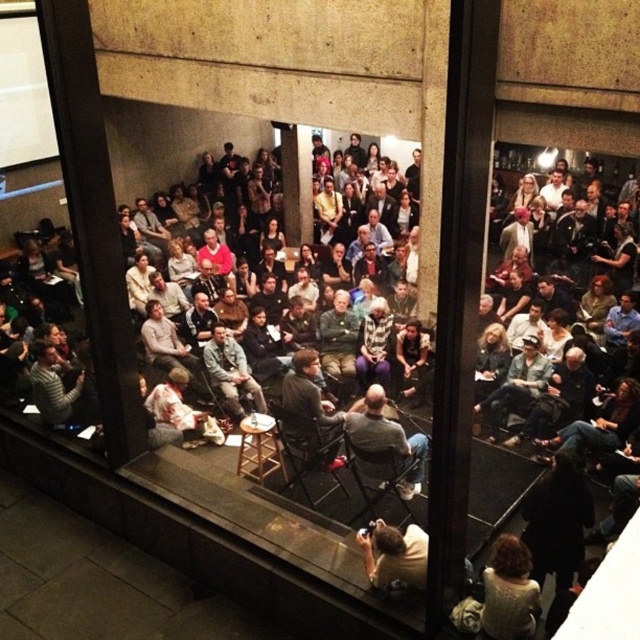
You are attending an event and notice two attendees wearing a white knit sweater at lower right and a camouflage jacket at center. If you were standing at the front of the stage, which direction would you need to look to see both individuals simultaneously?

To see both the white knit sweater at lower right and the camouflage jacket at center from the front of the stage, you should look towards the right side since the white knit sweater at lower right is positioned to the right of the camouflage jacket at center.

You are an event planner checking the seating arrangement from the window. You notice the white knit sweater at lower right and the camouflage jacket at center. Which clothing item is shorter in height?

The white knit sweater at lower right has a lesser height compared to the camouflage jacket at center, so the white knit sweater at lower right is shorter in height.